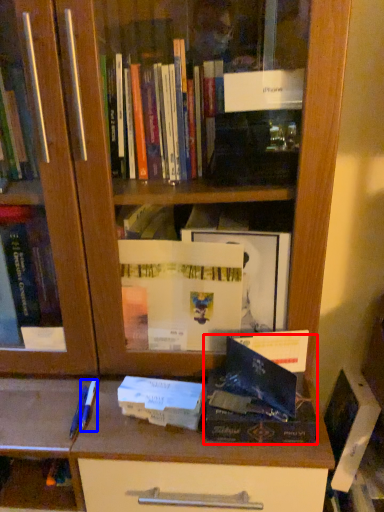
Question: Which object is closer to the camera taking this photo, paperback book (highlighted by a red box) or pen (highlighted by a blue box)?

Choices:
 (A) paperback book
 (B) pen

Answer: (A)